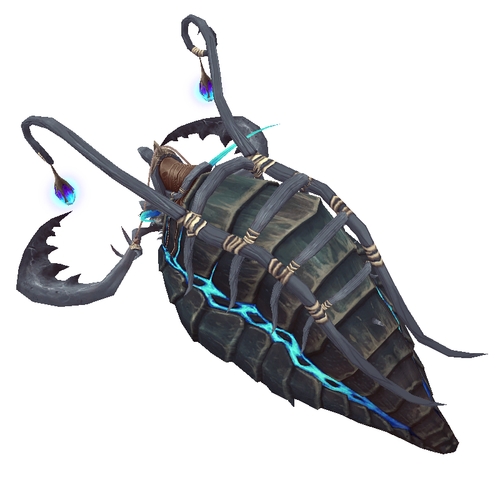
This screenshot has height=500, width=500. I want to click on lights, so click(66, 197), click(204, 88).